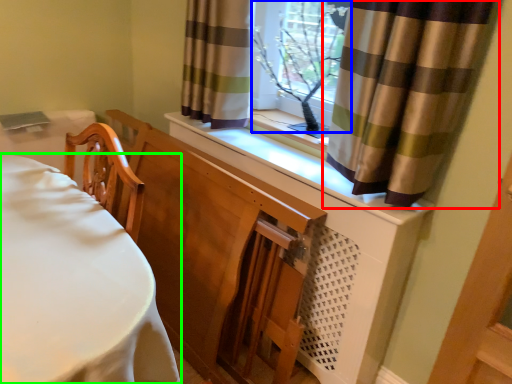
Question: Which object is positioned farthest from curtain (highlighted by a red box)? Select from window frame (highlighted by a blue box) and furniture (highlighted by a green box).

Choices:
 (A) window frame
 (B) furniture

Answer: (B)